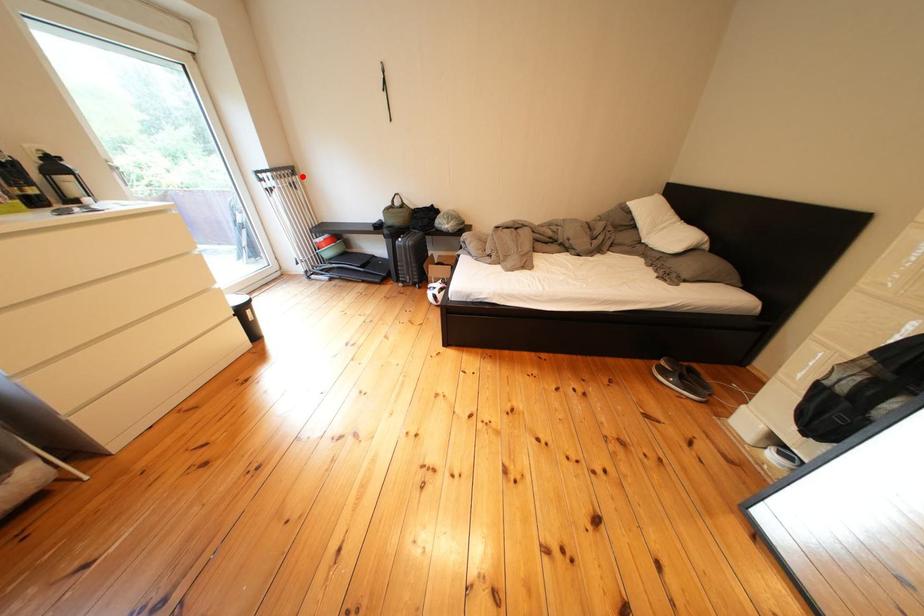
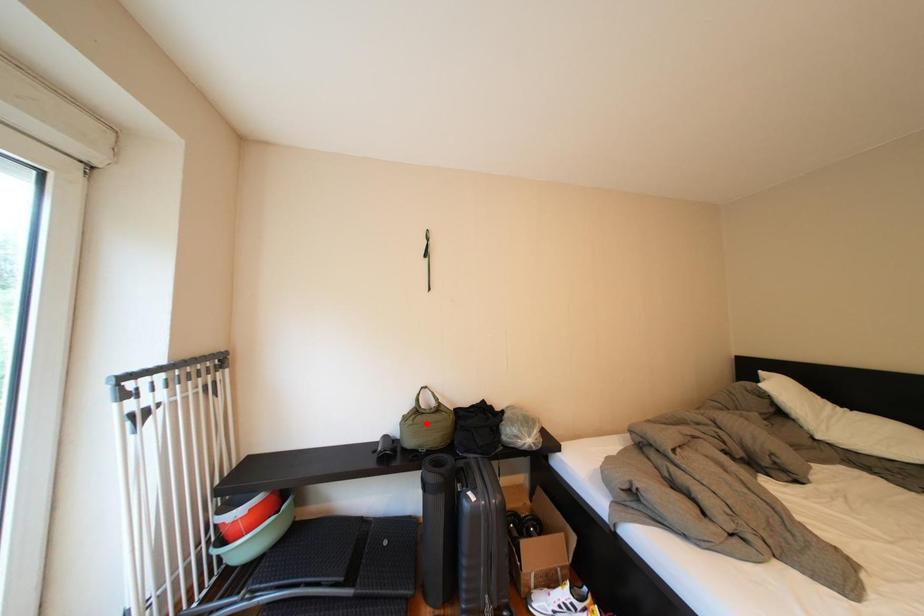
I am providing you with two images of the same scene from different viewpoints. A red point is marked on the first image and another point is marked on the second image. Do the highlighted points in image1 and image2 indicate the same real-world spot?

No